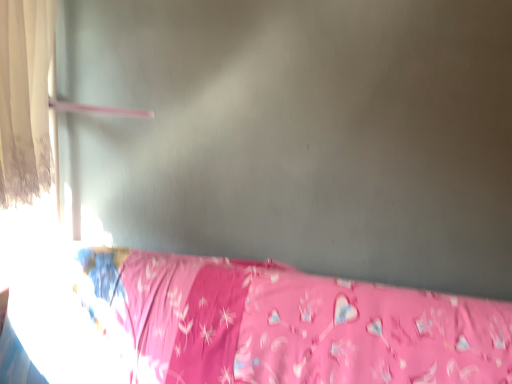
This screenshot has width=512, height=384. Describe the element at coordinates (25, 99) in the screenshot. I see `white sheer curtain at left` at that location.

You are a GUI agent. You are given a task and a screenshot of the screen. Output one action in this format:
    pyautogui.click(x=<x>, y=<y>)
    Task: Click on the white sheer curtain at left
    
    Given the screenshot: What is the action you would take?
    pyautogui.click(x=25, y=99)

Looking at this image, measure the distance between white sheer curtain at left and camera.

They are 3.96 feet apart.

Identify the location of pink fabric bed at lower right. This screenshot has width=512, height=384. coord(291,324).

Describe the element at coordinates (291, 324) in the screenshot. This screenshot has height=384, width=512. I see `pink fabric bed at lower right` at that location.

I want to click on white sheer curtain at left, so click(25, 99).

Considering the positions of objects white sheer curtain at left and pink fabric bed at lower right in the image provided, who is more to the left, white sheer curtain at left or pink fabric bed at lower right?

From the viewer's perspective, white sheer curtain at left appears more on the left side.

Does white sheer curtain at left come in front of pink fabric bed at lower right?

No, white sheer curtain at left is further to the viewer.

Which point is more forward, (39,142) or (418,320)?

The point (418,320) is more forward.

From the image's perspective, which object appears higher, white sheer curtain at left or pink fabric bed at lower right?

white sheer curtain at left.

From a real-world perspective, which is physically below, white sheer curtain at left or pink fabric bed at lower right?

In real-world perspective, pink fabric bed at lower right is lower.

In the scene shown: Is white sheer curtain at left wider than pink fabric bed at lower right?

No.

Based on the photo, does white sheer curtain at left have a greater height compared to pink fabric bed at lower right?

Indeed, white sheer curtain at left has a greater height compared to pink fabric bed at lower right.

Considering the sizes of white sheer curtain at left and pink fabric bed at lower right in the image, is white sheer curtain at left bigger or smaller than pink fabric bed at lower right?

white sheer curtain at left is smaller than pink fabric bed at lower right.

Based on the photo, is white sheer curtain at left situated inside pink fabric bed at lower right or outside?

white sheer curtain at left exists outside the volume of pink fabric bed at lower right.

Would you consider white sheer curtain at left to be distant from pink fabric bed at lower right?

Actually, white sheer curtain at left and pink fabric bed at lower right are a little close together.

Is white sheer curtain at left oriented towards pink fabric bed at lower right?

No, white sheer curtain at left is not turned towards pink fabric bed at lower right.

What's the angular difference between white sheer curtain at left and pink fabric bed at lower right's facing directions?

They differ by 92.8 degrees in their facing directions.

Measure the distance from white sheer curtain at left to pink fabric bed at lower right.

white sheer curtain at left and pink fabric bed at lower right are 28.98 inches apart.

Image resolution: width=512 pixels, height=384 pixels. Identify the location of furniture on the right of white sheer curtain at left. (291, 324).

Visually, is pink fabric bed at lower right positioned to the left or to the right of white sheer curtain at left?

Clearly, pink fabric bed at lower right is on the right of white sheer curtain at left in the image.

Is pink fabric bed at lower right further to the viewer compared to white sheer curtain at left?

No, it is not.

Does point (461, 337) come in front of point (15, 87)?

No, it is not.

From the image's perspective, which one is positioned lower, pink fabric bed at lower right or white sheer curtain at left?

pink fabric bed at lower right.

From a real-world perspective, is pink fabric bed at lower right above or below white sheer curtain at left?

In terms of real-world spatial position, pink fabric bed at lower right is below white sheer curtain at left.

In the scene shown: Between pink fabric bed at lower right and white sheer curtain at left, which one has larger width?

Wider between the two is pink fabric bed at lower right.

Does pink fabric bed at lower right have a lesser height compared to white sheer curtain at left?

Correct, pink fabric bed at lower right is not as tall as white sheer curtain at left.

Between pink fabric bed at lower right and white sheer curtain at left, which one has larger size?

With larger size is pink fabric bed at lower right.

Is white sheer curtain at left a part of pink fabric bed at lower right?

No, pink fabric bed at lower right does not contain white sheer curtain at left.

In the scene shown: Is pink fabric bed at lower right in contact with white sheer curtain at left?

No, pink fabric bed at lower right is not next to white sheer curtain at left.

Does pink fabric bed at lower right turn towards white sheer curtain at left?

No, pink fabric bed at lower right is not oriented towards white sheer curtain at left.

Measure the distance from pink fabric bed at lower right to white sheer curtain at left.

They are 28.98 inches apart.

The image size is (512, 384). I want to click on curtain above the pink fabric bed at lower right (from a real-world perspective), so click(25, 99).

At what (x,y) coordinates should I click in order to perform the action: click on furniture that is on the right side of white sheer curtain at left. Please return your answer as a coordinate pair (x, y). Looking at the image, I should click on (291, 324).

I want to click on furniture that is below the white sheer curtain at left (from the image's perspective), so click(291, 324).